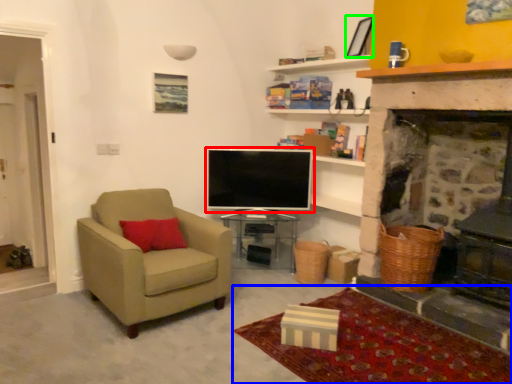
Question: Which object is the farthest from television (highlighted by a red box)? Choose among these: plain (highlighted by a blue box) or picture frame (highlighted by a green box).

Choices:
 (A) plain
 (B) picture frame

Answer: (A)